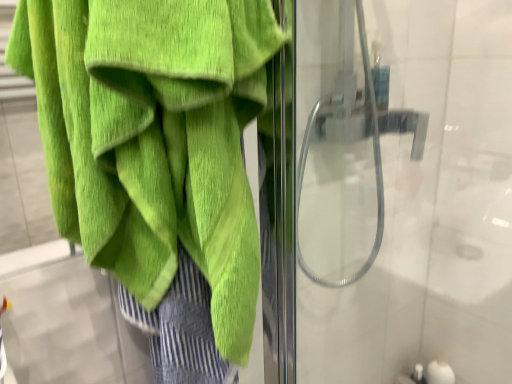
Question: Considering the positions of transparent glass shower door at right and green terry cloth towel at left in the image, is transparent glass shower door at right taller or shorter than green terry cloth towel at left?

Choices:
 (A) tall
 (B) short

Answer: (A)

Question: Relative to green terry cloth towel at left, is transparent glass shower door at right in front or behind?

Choices:
 (A) front
 (B) behind

Answer: (B)

Question: From a real-world perspective, is transparent glass shower door at right physically located above or below green terry cloth towel at left?

Choices:
 (A) above
 (B) below

Answer: (B)

Question: Considering the positions of green terry cloth towel at left and transparent glass shower door at right in the image, is green terry cloth towel at left taller or shorter than transparent glass shower door at right?

Choices:
 (A) tall
 (B) short

Answer: (B)

Question: Which is correct: green terry cloth towel at left is inside transparent glass shower door at right, or outside of it?

Choices:
 (A) inside
 (B) outside

Answer: (B)

Question: From a real-world perspective, relative to transparent glass shower door at right, is green terry cloth towel at left vertically above or below?

Choices:
 (A) below
 (B) above

Answer: (B)

Question: Considering the relative positions of green terry cloth towel at left and transparent glass shower door at right in the image provided, is green terry cloth towel at left to the left or to the right of transparent glass shower door at right?

Choices:
 (A) right
 (B) left

Answer: (B)